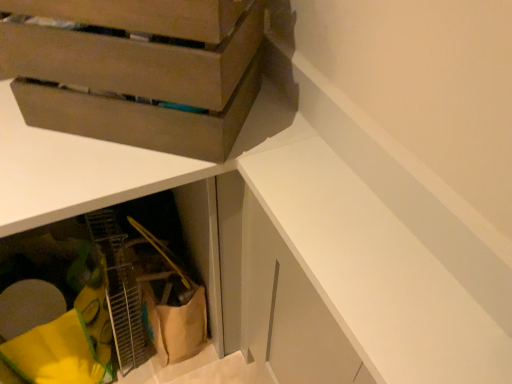
Image resolution: width=512 pixels, height=384 pixels. I want to click on empty space that is ontop of white matte cabinet at upper right, marked as the 1th cabinetry in a right-to-left arrangement (from a real-world perspective), so click(x=375, y=127).